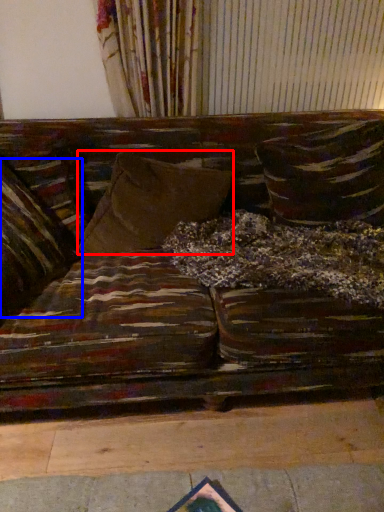
Question: Which of the following is the closest to the observer, pillow (highlighted by a red box) or pillow (highlighted by a blue box)?

Choices:
 (A) pillow
 (B) pillow

Answer: (B)